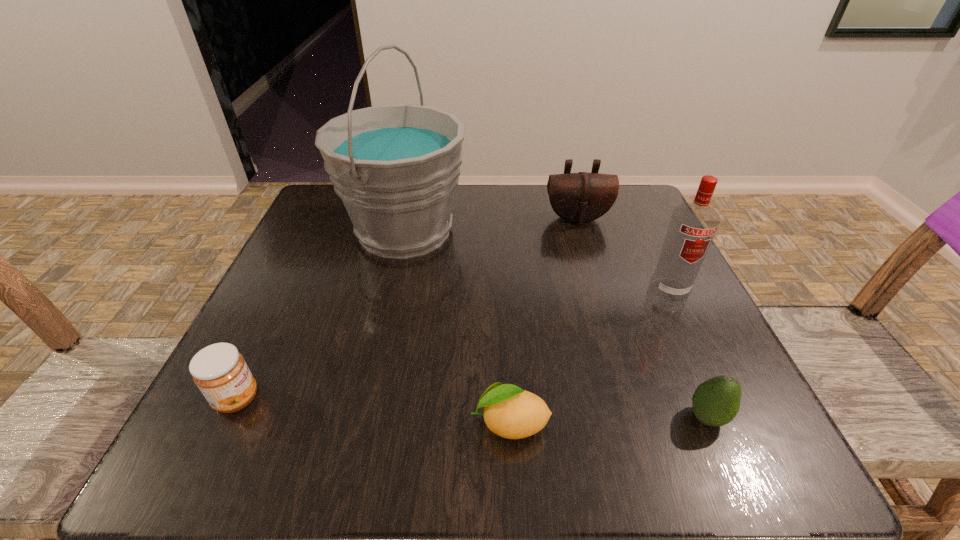
Where is `avocado that is at the near edge`? avocado that is at the near edge is located at coordinates (715, 402).

I want to click on lemon that is at the near edge, so click(510, 412).

The height and width of the screenshot is (540, 960). I want to click on bucket that is at the left edge, so click(x=395, y=167).

Where is `jam that is at the left edge`? The width and height of the screenshot is (960, 540). jam that is at the left edge is located at coordinates pos(220,372).

The height and width of the screenshot is (540, 960). Find the location of `vodka that is at the right edge`. vodka that is at the right edge is located at coordinates (692, 227).

Locate an element on the screen. This screenshot has width=960, height=540. pouch present at the right edge is located at coordinates (582, 197).

At what (x,y) coordinates should I click in order to perform the action: click on avocado located at the right edge. Please return your answer as a coordinate pair (x, y). Looking at the image, I should click on (715, 402).

This screenshot has width=960, height=540. Find the location of `object that is at the far left corner`. object that is at the far left corner is located at coordinates (x=395, y=167).

Identify the location of object at the near left corner. (220, 372).

Identify the location of object positioned at the far right corner. The height and width of the screenshot is (540, 960). (582, 197).